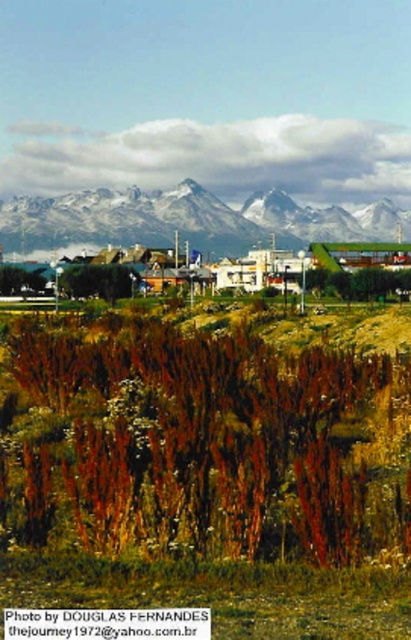
Question: Which object is positioned closest to the white matte building at center?

Choices:
 (A) snowy granite mountain range at upper center
 (B) brown grass at lower center

Answer: (A)

Question: Estimate the real-world distances between objects in this image. Which object is farther from the white matte building at center?

Choices:
 (A) snowy granite mountain range at upper center
 (B) brown grass at lower center

Answer: (B)

Question: Where is brown grass at lower center located in relation to snowy granite mountain range at upper center in the image?

Choices:
 (A) above
 (B) below

Answer: (B)

Question: Can you confirm if brown grass at lower center is positioned to the right of snowy granite mountain range at upper center?

Choices:
 (A) no
 (B) yes

Answer: (B)

Question: Among these objects, which one is farthest from the camera?

Choices:
 (A) snowy granite mountain range at upper center
 (B) white matte building at center

Answer: (A)

Question: Can you confirm if brown grass at lower center is positioned above white matte building at center?

Choices:
 (A) no
 (B) yes

Answer: (A)